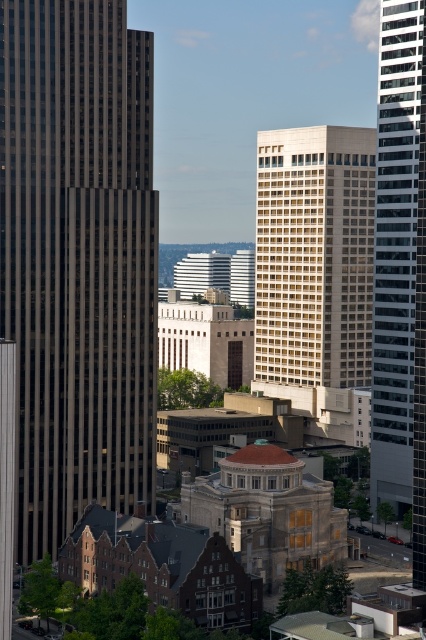
Question: Among these objects, which one is nearest to the camera?

Choices:
 (A) white textured building at center
 (B) dark glass skyscraper at left

Answer: (B)

Question: Among these points, which one is farthest from the camera?

Choices:
 (A) (391, 412)
 (B) (131, 403)
 (C) (275, 266)

Answer: (C)

Question: From the image, what is the correct spatial relationship of dark glass skyscraper at left in relation to white textured building at center?

Choices:
 (A) above
 (B) below

Answer: (A)

Question: Does dark glass skyscraper at left appear on the left side of white textured building at center?

Choices:
 (A) no
 (B) yes

Answer: (B)

Question: From the image, what is the correct spatial relationship of white textured building at center in relation to glassy reflective skyscraper at right?

Choices:
 (A) right
 (B) left

Answer: (B)

Question: Among these objects, which one is nearest to the camera?

Choices:
 (A) white textured building at center
 (B) dark glass skyscraper at left

Answer: (B)